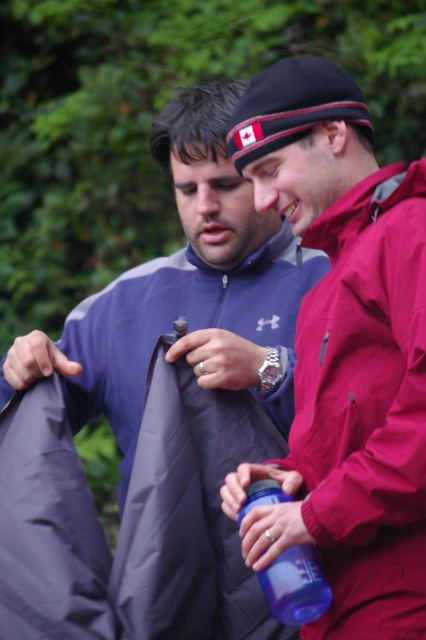
You are a photographer trying to capture a candid shot of the matte red jacket at right and the blue plastic water bottle at center. Since you want the water bottle to be in focus, which object should you adjust your camera focus on first?

The matte red jacket at right is closer to the viewer than the blue plastic water bottle at center, so to focus on the water bottle, you should adjust your camera focus to the blue plastic water bottle at center first.

You are a photographer trying to capture a closeup of the blue plastic water bottle at center. The matte blue jacket at center is blocking your view. Can you determine if you can tilt your camera upwards to see the water bottle without moving the jacket?

The matte blue jacket at center is taller than blue plastic water bottle at center. Since the jacket is taller, tilting the camera upwards might allow you to see the water bottle if it is positioned lower than the jacket.

You are a photographer trying to capture a photo of both the matte blue jacket at center and the matte red jacket at right. Since you want to ensure both are in focus, which jacket should you focus on first to account for their distances?

You should focus on the matte red jacket at right first because it is farther away from the viewer than the matte blue jacket at center, so adjusting focus from far to near ensures both are in focus.